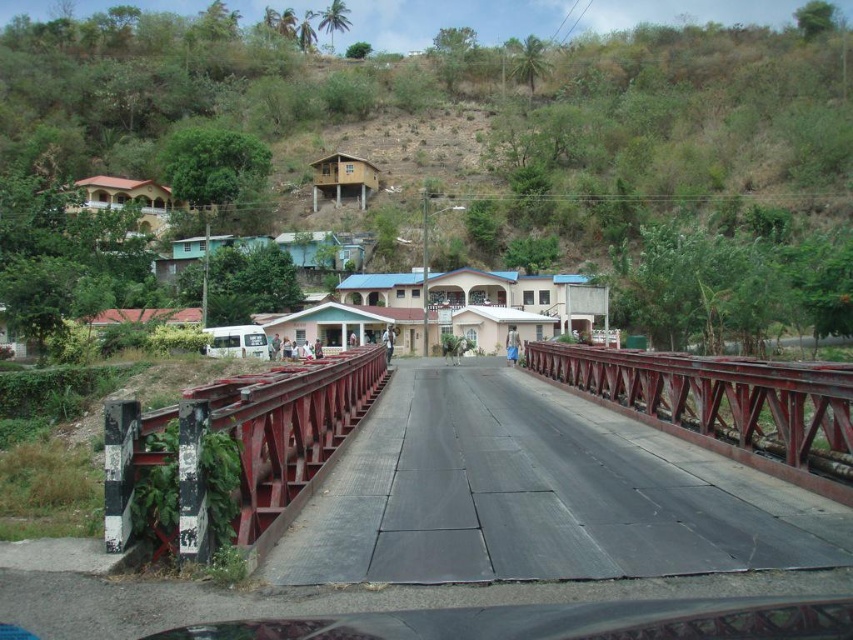
You are a truck driver transporting a load that requires a bridge with a minimum width of 4 meters. You see the metallic bridge at center and the rusty metal bridge at left. Which bridge should you choose to ensure your truck can safely cross?

The metallic bridge at center might be wider than rusty metal bridge at left, so you should choose the metallic bridge at center to ensure your truck can safely cross.

You are a delivery driver who needs to cross the river to deliver packages to the houses in the background. You see two bridges, the metallic bridge at center and the rusty metal bridge at left. Which bridge should you choose to ensure your vehicle can safely cross?

The metallic bridge at center is larger in size than the rusty metal bridge at left, so it can support the vehicle better and is safer for crossing.

You are a delivery driver needing to cross the river. You see a metallic bridge at center and a rusty metal bridge at left. Which bridge is closer to your current position if you are standing on the left bank?

The rusty metal bridge at left is closer to your current position because the metallic bridge at center is positioned on the right side of the rusty metal bridge at left, meaning the rusty metal bridge is closer to the left bank.